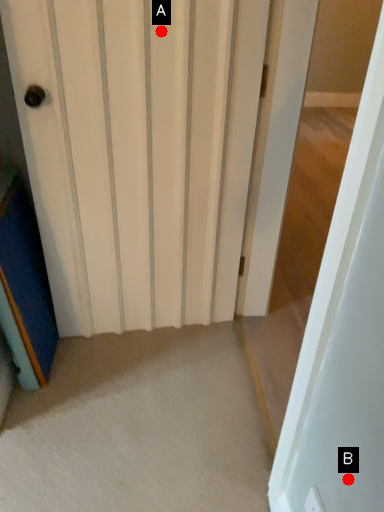
Question: Two points are circled on the image, labeled by A and B beside each circle. Which point is farther to the camera?

Choices:
 (A) A is further
 (B) B is further

Answer: (A)